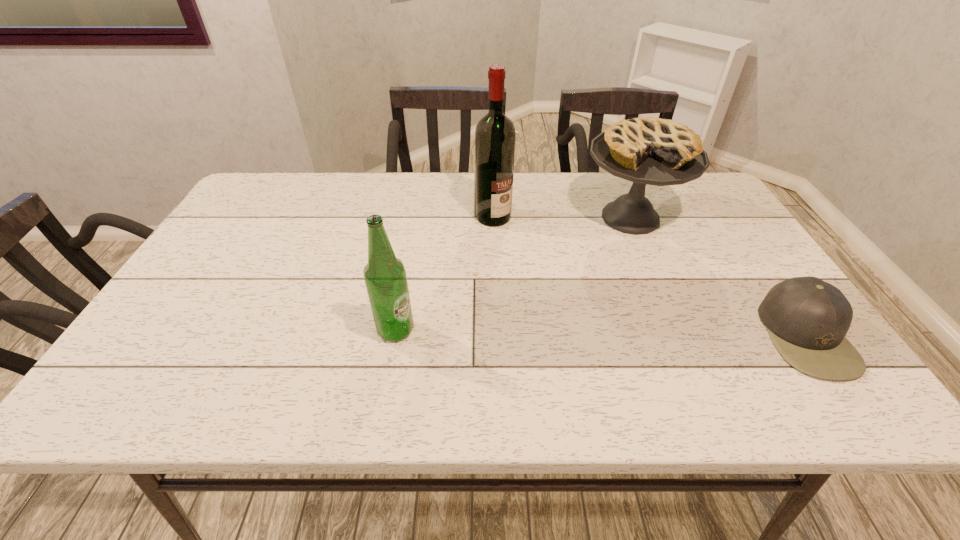
The image size is (960, 540). In order to click on object that can be found as the third closest to the pie in this screenshot , I will do `click(385, 277)`.

I want to click on the third closest object to the rightmost object, so click(385, 277).

Image resolution: width=960 pixels, height=540 pixels. I want to click on free spot that satisfies the following two spatial constraints: 1. on the front side of the second object from right to left; 2. on the right side of the tallest object, so click(493, 218).

What are the coordinates of `free region that satisfies the following two spatial constraints: 1. on the front side of the second object from right to left; 2. on the brim of the rightmost object` in the screenshot? It's located at (681, 335).